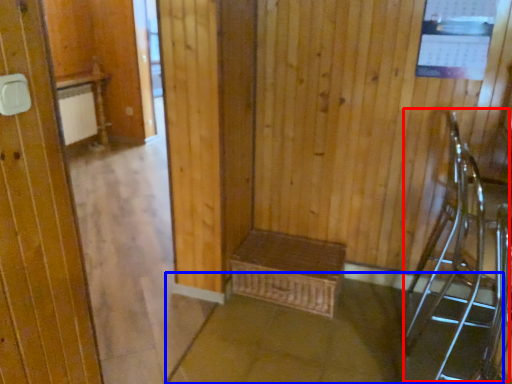
Question: Which of the following is the farthest to the observer, armchair (highlighted by a red box) or concrete (highlighted by a blue box)?

Choices:
 (A) armchair
 (B) concrete

Answer: (B)